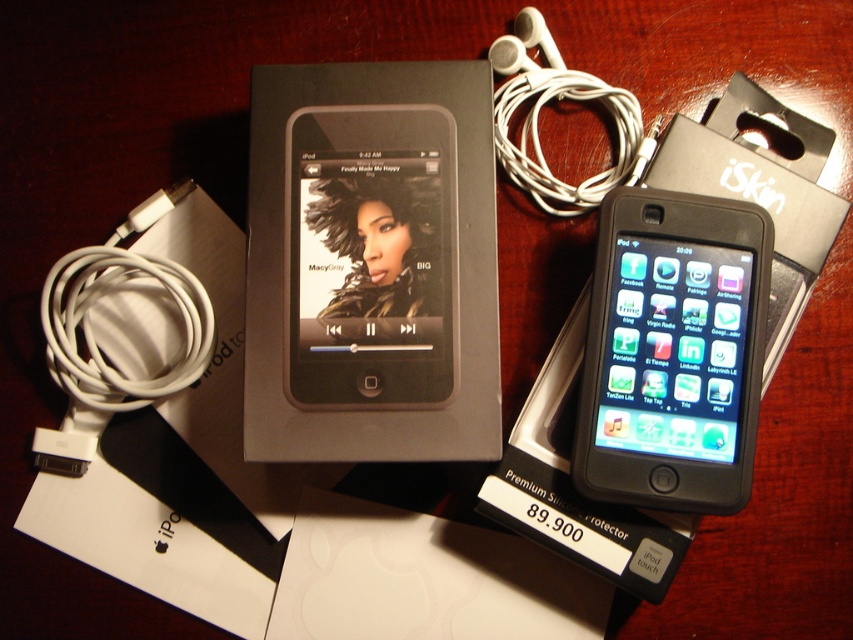
You are setting up a display for an electronics store and need to ensure there is enough space between the black matte ipod at center and the black matte ipod at upper center. According to the store guidelines, items must be at least 20 centimeters apart. Can you confirm if the current spacing meets the requirement?

The black matte ipod at center and the black matte ipod at upper center are 20.02 centimeters apart from each other, which exceeds the minimum requirement of 20 centimeters. Therefore, the spacing meets the store guidelines.

You are organizing a tech store display and need to place a new product between the black matte ipod at center and the black matte ipod at upper center. Which position should the new product be placed closer to the viewer to maintain the existing depth arrangement?

The new product should be placed closer to the black matte ipod at center because it is already further to the viewer than the black matte ipod at upper center, so maintaining that depth would require placing the new item in line with the closer iPod.

You are organizing a tech showcase and need to place a new accessory next to the black matte iPod at upper center. According to the layout, where should you position it to ensure it aligns with the existing arrangement?

The black matte iPod at upper center is located at point (672, 352), so you should position the new accessory near those coordinates to maintain alignment with the existing arrangement.